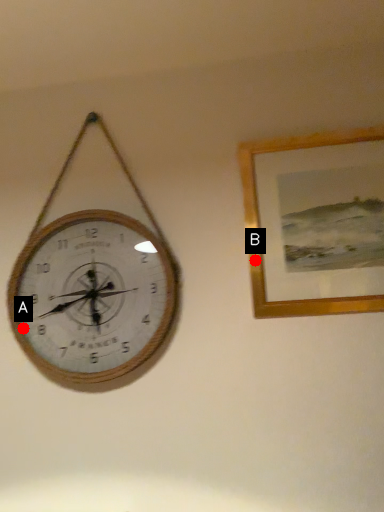
Question: Two points are circled on the image, labeled by A and B beside each circle. Which point is farther from the camera taking this photo?

Choices:
 (A) A is further
 (B) B is further

Answer: (A)